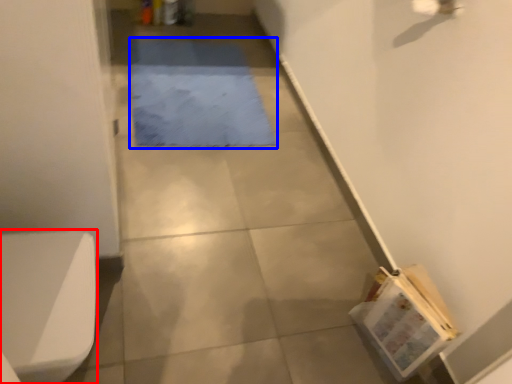
Question: Which object is closer to the camera taking this photo, toilet bowl (highlighted by a red box) or mat (highlighted by a blue box)?

Choices:
 (A) toilet bowl
 (B) mat

Answer: (A)